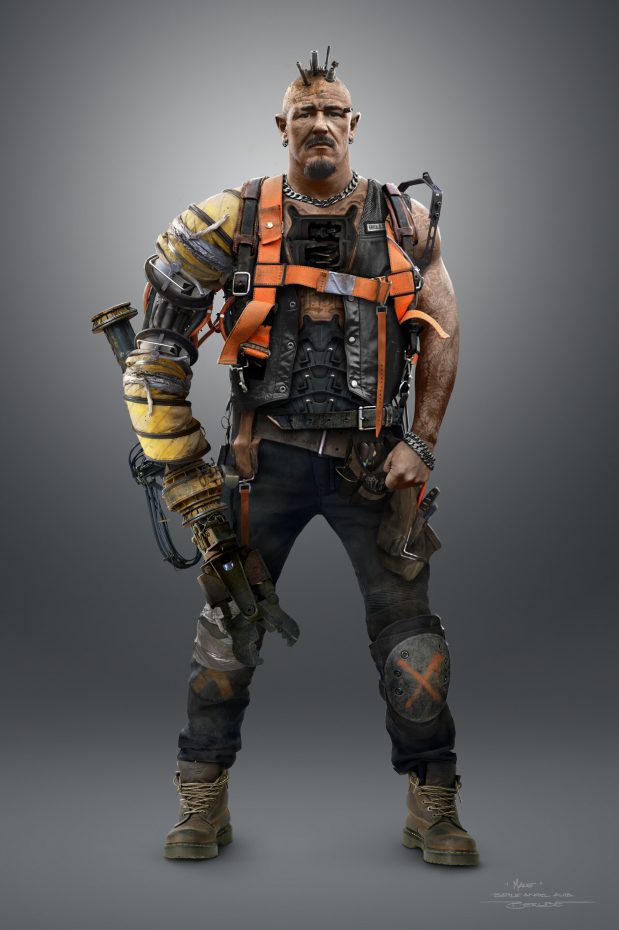
The height and width of the screenshot is (930, 619). What are the coordinates of `knife handle` in the screenshot? It's located at (422, 507).